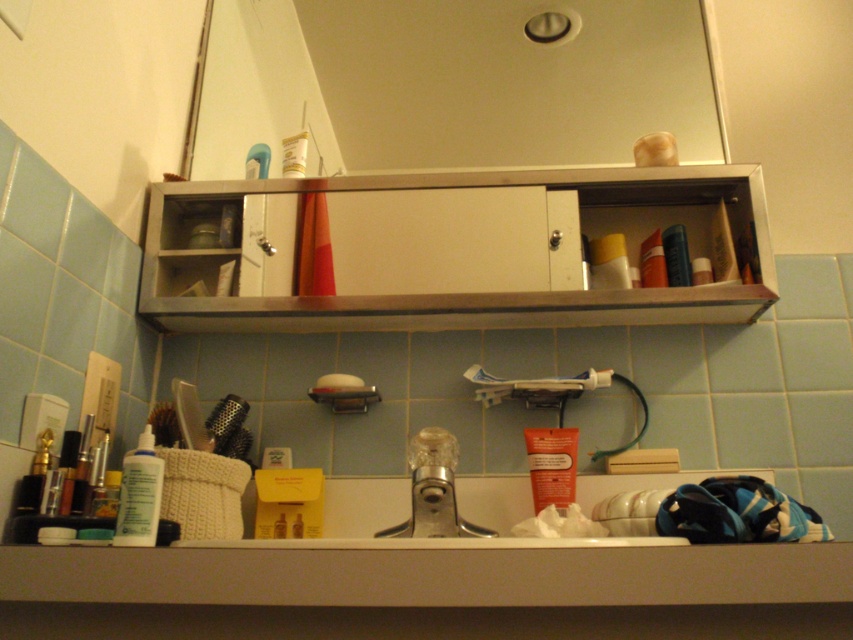
You are standing in front of the bathroom sink and want to reach both the point at coordinates point [602,243] and the point at coordinates point [352,380]. Which point will you need to stretch your hand further to reach?

You will need to stretch your hand further to reach point [602,243] because it is further away from you than point [352,380].

You are standing in front of the bathroom sink. You need to reach for an item that is closer to you. Which one should you choose between the clear glass faucet at center and the white matte tube at upper center?

The clear glass faucet at center is closer to the viewer than the white matte tube at upper center, so you should choose the clear glass faucet at center.